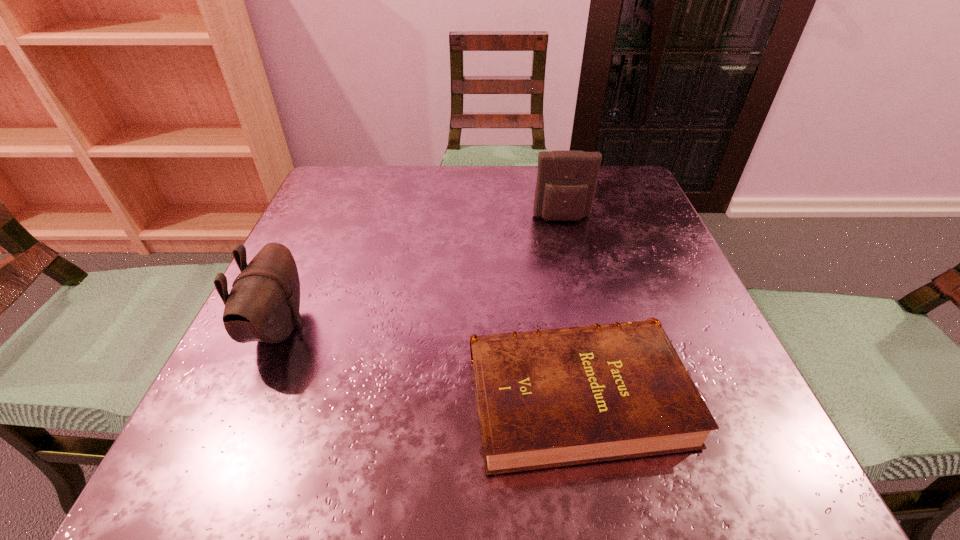
The height and width of the screenshot is (540, 960). Find the location of `free space between the leftmost object and the right pouch`. free space between the leftmost object and the right pouch is located at coordinates (420, 273).

Locate an element on the screen. unoccupied position between the farther pouch and the hardback book is located at coordinates (569, 307).

Identify the location of empty location between the hardback book and the leftmost object. Image resolution: width=960 pixels, height=540 pixels. (428, 362).

Where is `free space between the farthest object and the hardback book`? Image resolution: width=960 pixels, height=540 pixels. free space between the farthest object and the hardback book is located at coordinates (569, 307).

Image resolution: width=960 pixels, height=540 pixels. In order to click on free space between the farther pouch and the hardback book in this screenshot , I will do `click(569, 307)`.

At what (x,y) coordinates should I click in order to perform the action: click on empty space between the right pouch and the left pouch. Please return your answer as a coordinate pair (x, y). The width and height of the screenshot is (960, 540). Looking at the image, I should click on (420, 273).

The width and height of the screenshot is (960, 540). I want to click on blank region between the leftmost object and the farthest object, so click(x=420, y=273).

What are the coordinates of `vacant area that lies between the leftmost object and the right pouch` in the screenshot? It's located at (420, 273).

Find the location of a particular element. free space between the left pouch and the farther pouch is located at coordinates (420, 273).

The width and height of the screenshot is (960, 540). Identify the location of vacant area between the left pouch and the hardback book. (428, 362).